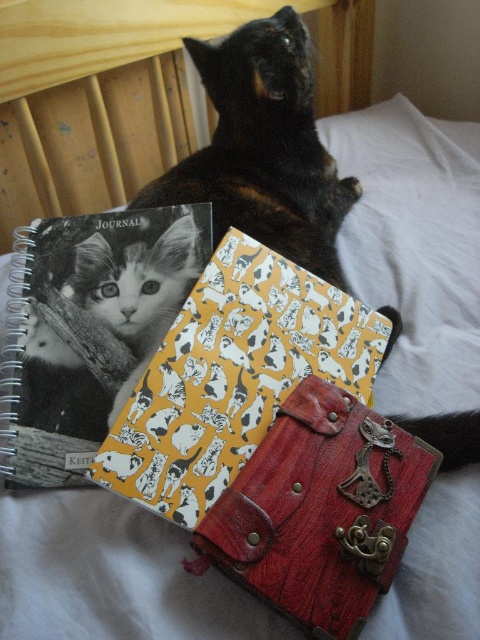
Question: Which of the following is the farthest from the observer?

Choices:
 (A) (371, 200)
 (B) (86, 419)

Answer: (A)

Question: Does white soft pillow at upper right appear on the left side of black and white fur cat at center?

Choices:
 (A) yes
 (B) no

Answer: (B)

Question: Which of the following is the farthest from the observer?

Choices:
 (A) (418, 292)
 (B) (153, 248)

Answer: (A)

Question: Among these objects, which one is farthest from the camera?

Choices:
 (A) white soft pillow at upper right
 (B) yellow paper with cat pattern at center

Answer: (A)

Question: Is yellow paper with cat pattern at center positioned behind white soft pillow at upper right?

Choices:
 (A) yes
 (B) no

Answer: (B)

Question: Does yellow paper with cat pattern at center appear on the left side of black and white fur cat at center?

Choices:
 (A) no
 (B) yes

Answer: (A)